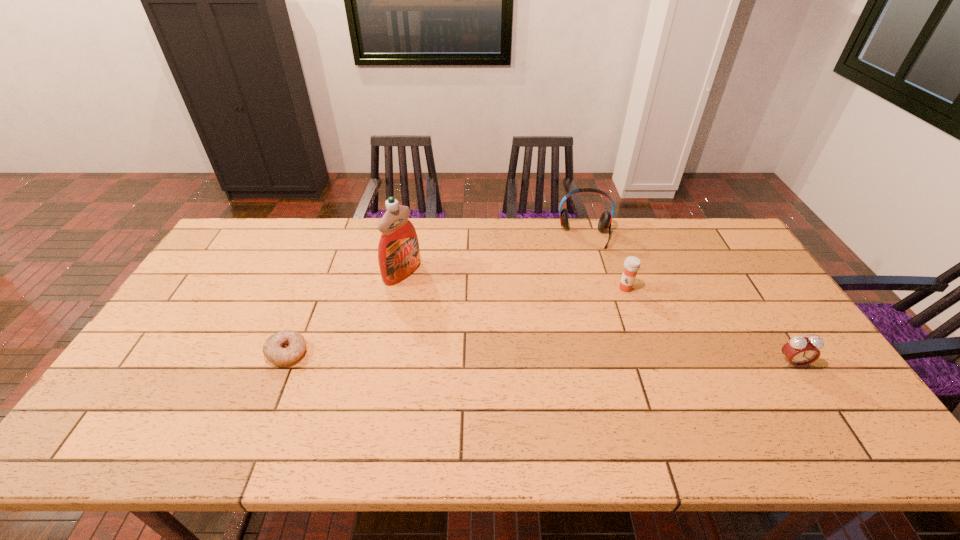
Where is `the shortest object`? the shortest object is located at coordinates (282, 348).

At what (x,y) coordinates should I click in order to perform the action: click on doughnut. Please return your answer as a coordinate pair (x, y). The width and height of the screenshot is (960, 540). Looking at the image, I should click on (282, 348).

The width and height of the screenshot is (960, 540). I want to click on alarm clock, so click(x=800, y=351).

Locate an element on the screen. The height and width of the screenshot is (540, 960). medicine is located at coordinates [632, 264].

The image size is (960, 540). Find the location of `the fourth object from right to left`. the fourth object from right to left is located at coordinates (398, 251).

Locate an element on the screen. Image resolution: width=960 pixels, height=540 pixels. the tallest object is located at coordinates (398, 251).

Find the location of a particular element. Image resolution: width=960 pixels, height=540 pixels. headset is located at coordinates (x=604, y=223).

Where is `the farthest object`? the farthest object is located at coordinates (604, 223).

This screenshot has width=960, height=540. In order to click on vacant area situated 0.340m on the back of the shortest object in this screenshot , I will do `click(324, 260)`.

The image size is (960, 540). Find the location of `vacant space situated on the clock face of the alarm clock`. vacant space situated on the clock face of the alarm clock is located at coordinates (811, 393).